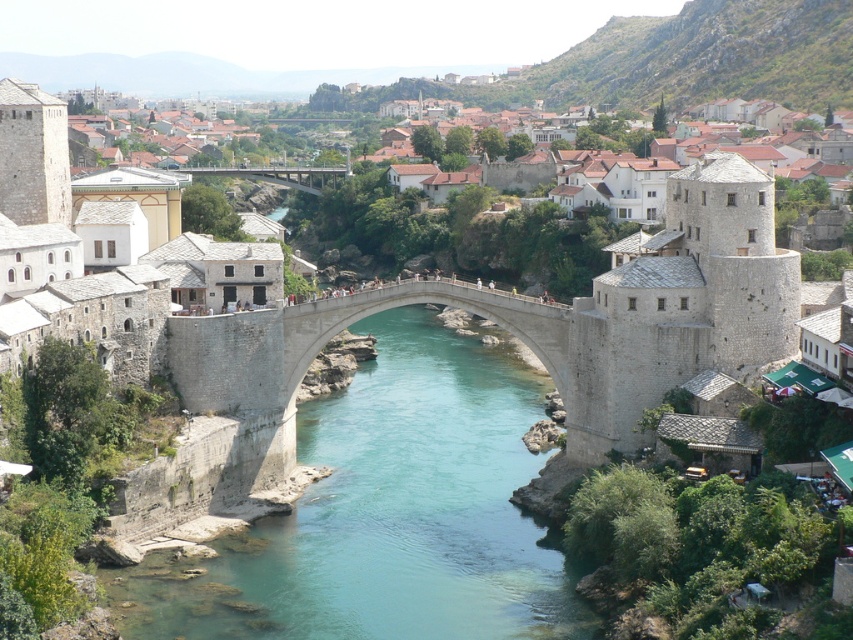
Is white stone tower at center positioned behind concrete bridge at center?

That is False.

In the scene shown: Is white stone tower at center taller than concrete bridge at center?

Yes.

Who is more forward, (683, 161) or (231, 173)?

Point (683, 161) is in front.

Where is `white stone tower at center`? white stone tower at center is located at coordinates click(x=776, y=161).

Does clear blue water at center have a greater height compared to concrete bridge at center?

Correct, clear blue water at center is much taller as concrete bridge at center.

The width and height of the screenshot is (853, 640). Find the location of `clear blue water at center`. clear blue water at center is located at coordinates (392, 513).

The height and width of the screenshot is (640, 853). What are the coordinates of `clear blue water at center` in the screenshot? It's located at (392, 513).

Which is more to the left, clear blue water at center or white stone tower at center?

clear blue water at center

Is clear blue water at center bigger than white stone tower at center?

Actually, clear blue water at center might be smaller than white stone tower at center.

Describe the element at coordinates (392, 513) in the screenshot. I see `clear blue water at center` at that location.

Locate an element on the screen. The width and height of the screenshot is (853, 640). clear blue water at center is located at coordinates (392, 513).